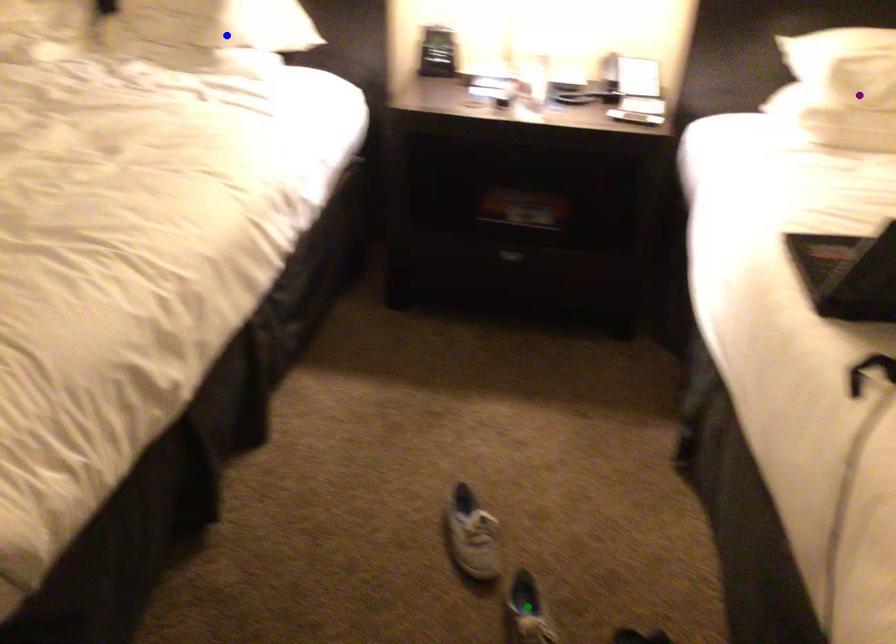
Order these from nearest to farthest:
1. purple point
2. blue point
3. green point

green point → purple point → blue point